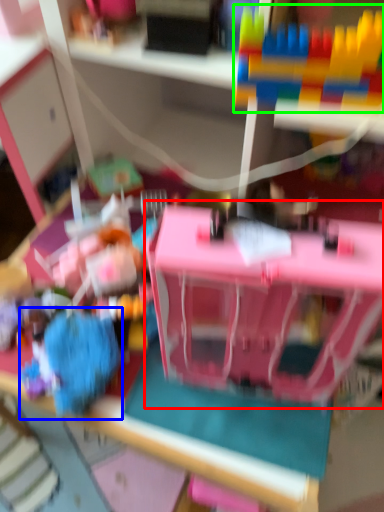
Question: Considering the real-world distances, which object is farthest from toy (highlighted by a red box)? toy (highlighted by a blue box) or toy (highlighted by a green box)?

Choices:
 (A) toy
 (B) toy

Answer: (B)